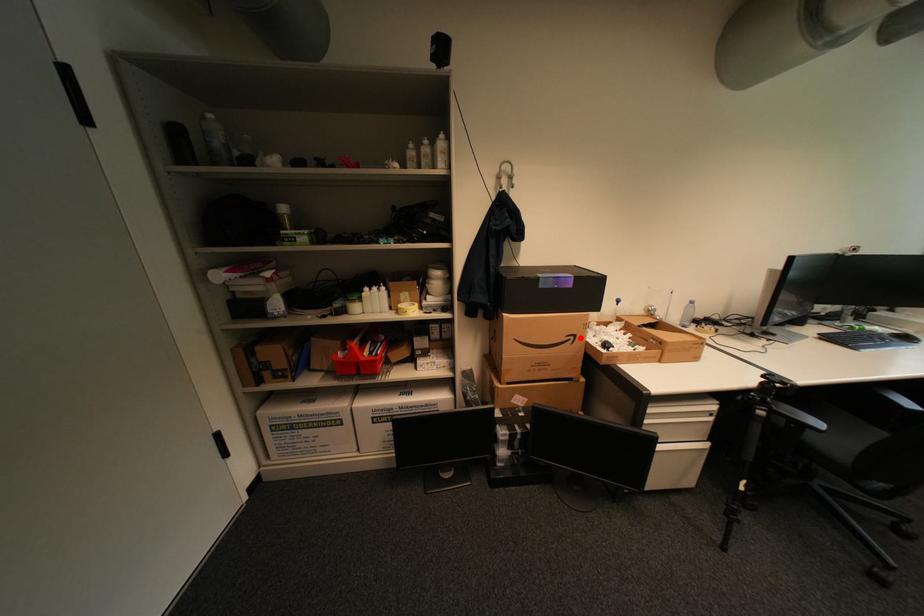
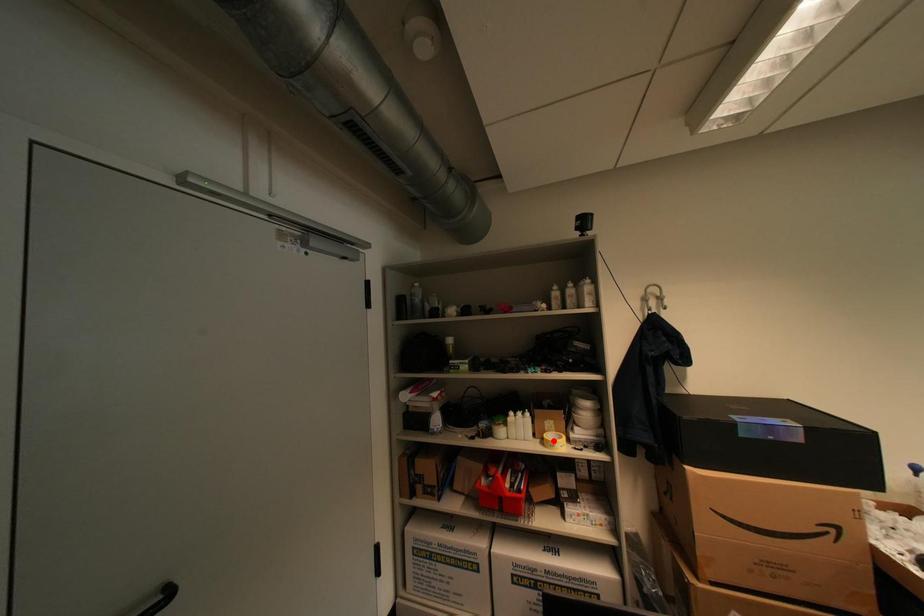
I am providing you with two images of the same scene from different viewpoints. A red point is marked on the first image and another point is marked on the second image. Is the marked point in image1 the same physical position as the marked point in image2?

No